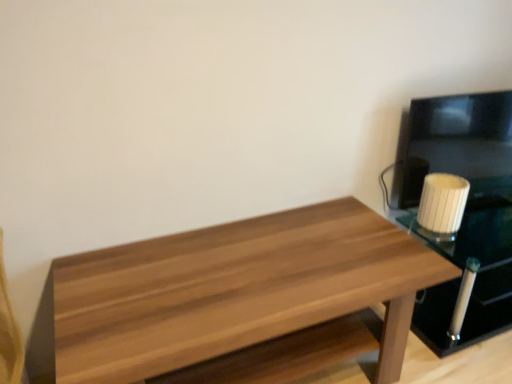
Question: Is wooden table at center outside of white glossy candle at right?

Choices:
 (A) no
 (B) yes

Answer: (B)

Question: Is wooden table at center placed right next to white glossy candle at right?

Choices:
 (A) yes
 (B) no

Answer: (B)

Question: Is wooden table at center at the left side of white glossy candle at right?

Choices:
 (A) yes
 (B) no

Answer: (A)

Question: From the image's perspective, is wooden table at center beneath white glossy candle at right?

Choices:
 (A) no
 (B) yes

Answer: (B)

Question: From a real-world perspective, is wooden table at center on white glossy candle at right?

Choices:
 (A) yes
 (B) no

Answer: (A)

Question: Relative to white glossy candle at right, is white ribbed glass at right in front or behind?

Choices:
 (A) front
 (B) behind

Answer: (B)

Question: Considering the positions of white ribbed glass at right and white glossy candle at right in the image, is white ribbed glass at right wider or thinner than white glossy candle at right?

Choices:
 (A) thin
 (B) wide

Answer: (A)

Question: Do you think white ribbed glass at right is within white glossy candle at right, or outside of it?

Choices:
 (A) outside
 (B) inside

Answer: (A)

Question: From the image's perspective, relative to white glossy candle at right, is white ribbed glass at right above or below?

Choices:
 (A) above
 (B) below

Answer: (A)

Question: In the image, is wooden table at center on the left side or the right side of white ribbed glass at right?

Choices:
 (A) left
 (B) right

Answer: (A)

Question: Considering the positions of wooden table at center and white ribbed glass at right in the image, is wooden table at center taller or shorter than white ribbed glass at right?

Choices:
 (A) short
 (B) tall

Answer: (B)

Question: From the image's perspective, is wooden table at center positioned above or below white ribbed glass at right?

Choices:
 (A) above
 (B) below

Answer: (B)

Question: Which is correct: wooden table at center is inside white ribbed glass at right, or outside of it?

Choices:
 (A) outside
 (B) inside

Answer: (A)

Question: From a real-world perspective, is white ribbed glass at right physically located above or below wooden table at center?

Choices:
 (A) above
 (B) below

Answer: (A)

Question: From the image's perspective, is white ribbed glass at right positioned above or below wooden table at center?

Choices:
 (A) above
 (B) below

Answer: (A)